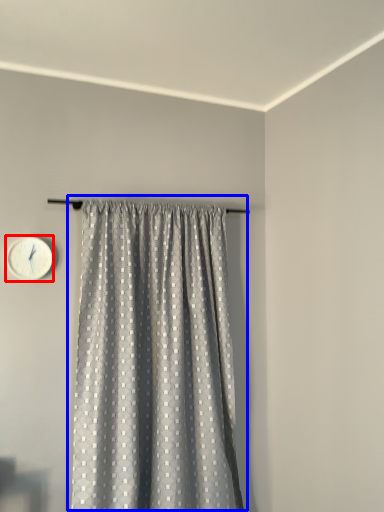
Question: Which point is closer to the camera, wall clock (highlighted by a red box) or curtain (highlighted by a blue box)?

Choices:
 (A) wall clock
 (B) curtain

Answer: (B)